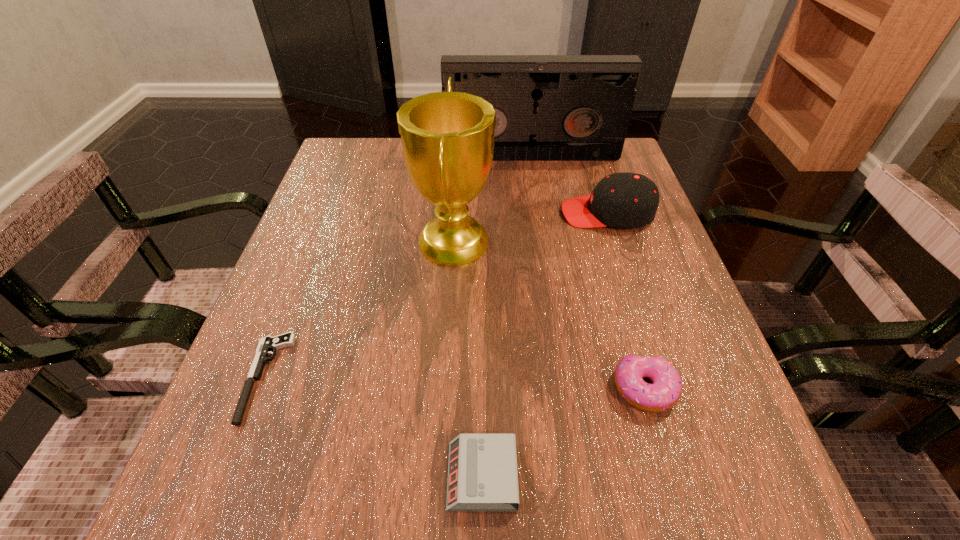
This screenshot has width=960, height=540. I want to click on free space between the award and the cap, so [530, 226].

Locate an element on the screen. free space between the pistol and the videotape is located at coordinates point(398,267).

I want to click on free space between the second tallest object and the alarm clock, so click(507, 316).

At what (x,y) coordinates should I click in order to perform the action: click on vacant area that lies between the tallest object and the alarm clock. Please return your answer as a coordinate pair (x, y). Looking at the image, I should click on (468, 358).

Find the location of a particular element. The width and height of the screenshot is (960, 540). vacant space that is in between the second shortest object and the fourth tallest object is located at coordinates (x=564, y=433).

Identify the location of empty space that is in between the nearest object and the third shortest object. This screenshot has height=540, width=960. (564, 433).

You are a GUI agent. You are given a task and a screenshot of the screen. Output one action in this format:
    pyautogui.click(x=<x>, y=<y>)
    Task: Click on the vacant region between the fourth shortest object and the fourth tallest object
    
    Given the screenshot: What is the action you would take?
    pyautogui.click(x=626, y=301)

You are a GUI agent. You are given a task and a screenshot of the screen. Output one action in this format:
    pyautogui.click(x=<x>, y=<y>)
    Task: Click on the free spot between the pistol and the third shortest object
    This screenshot has height=540, width=960.
    Given the screenshot: What is the action you would take?
    pyautogui.click(x=455, y=383)

Image resolution: width=960 pixels, height=540 pixels. In order to click on free spot between the tallest object and the farthest object in this screenshot , I will do `click(492, 198)`.

Find the location of a particular element. Image resolution: width=960 pixels, height=540 pixels. object that is the fourth closest to the doughnut is located at coordinates (266, 344).